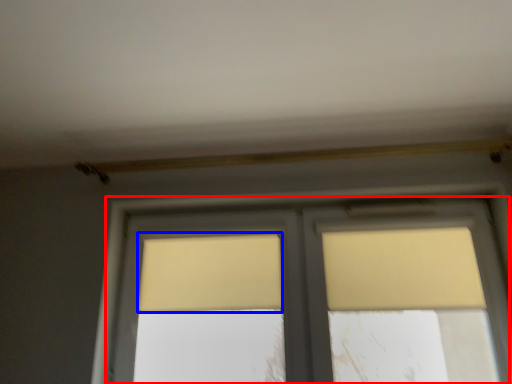
Question: Which object appears closest to the camera in this image, window (highlighted by a red box) or curtain (highlighted by a blue box)?

Choices:
 (A) window
 (B) curtain

Answer: (A)